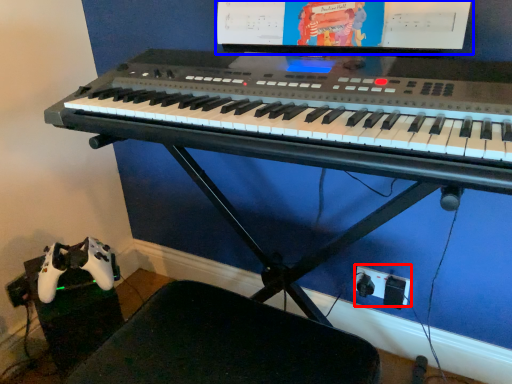
Question: Which object is closer to the camera taking this photo, plug (highlighted by a red box) or computer monitor (highlighted by a blue box)?

Choices:
 (A) plug
 (B) computer monitor

Answer: (B)